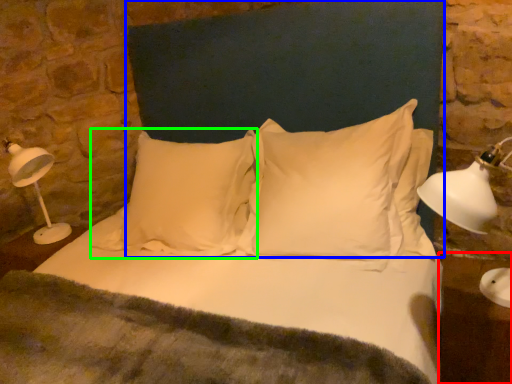
Question: Which object is positioned farthest from table (highlighted by a red box)? Select from headboard (highlighted by a blue box) and pillow (highlighted by a green box).

Choices:
 (A) headboard
 (B) pillow

Answer: (B)